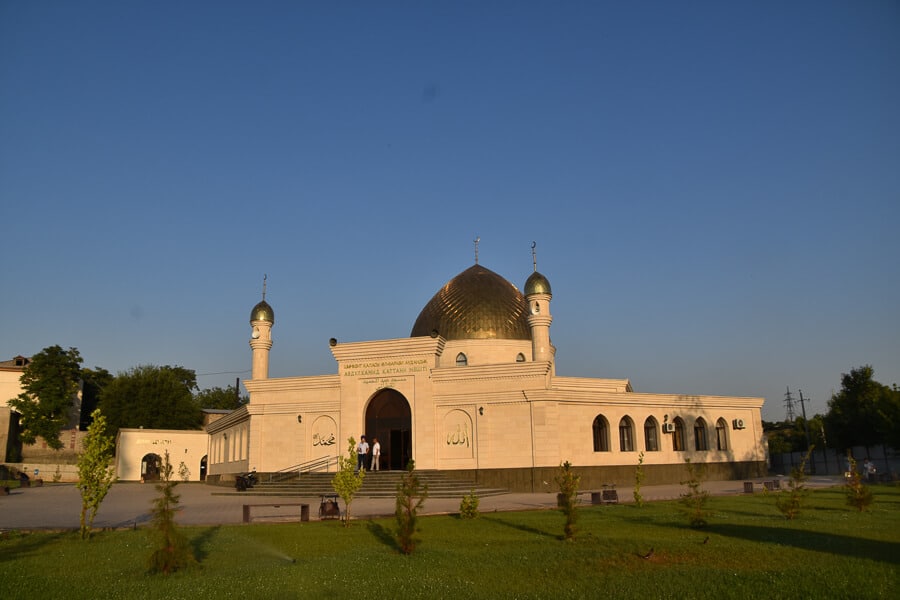
Locate an element on the screen. This screenshot has width=900, height=600. arched opening is located at coordinates (601, 428), (625, 438), (651, 436), (679, 438), (704, 438), (720, 439), (380, 408), (148, 469).